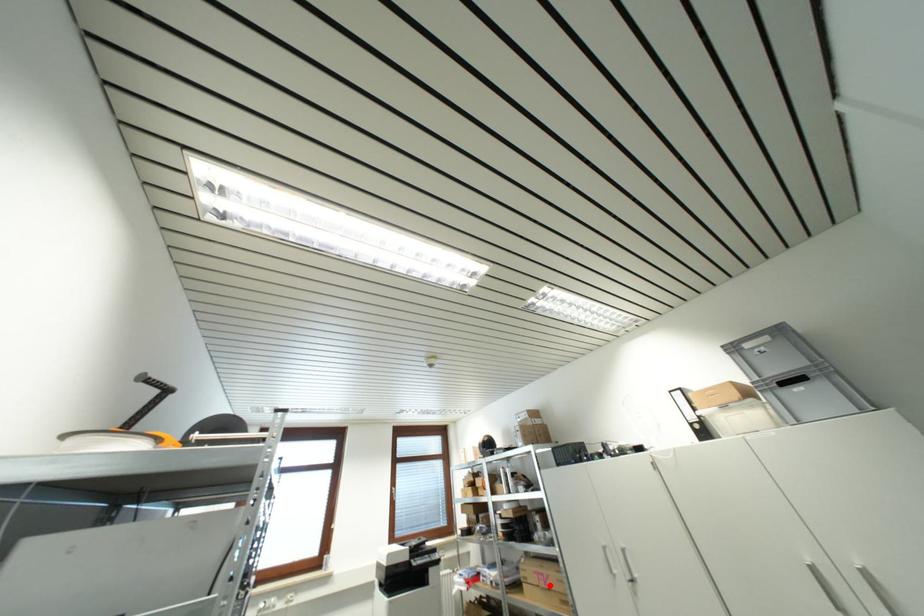
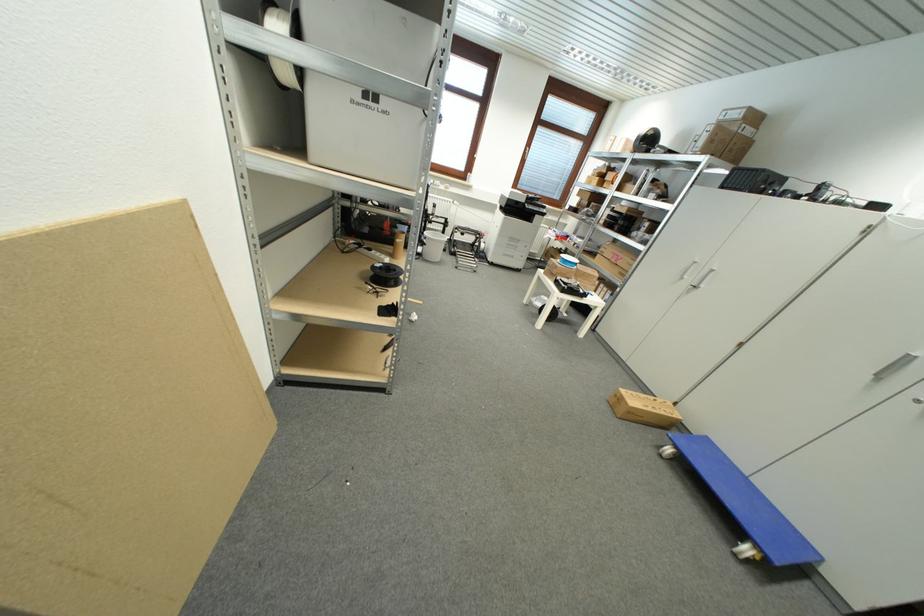
Question: I am providing you with two images of the same scene from different viewpoints. Image1 has a red point marked. In image2, the corresponding 3D location appears at what relative position? Reply with the corresponding letter.

Choices:
 (A) Closer
 (B) Farther

Answer: (A)